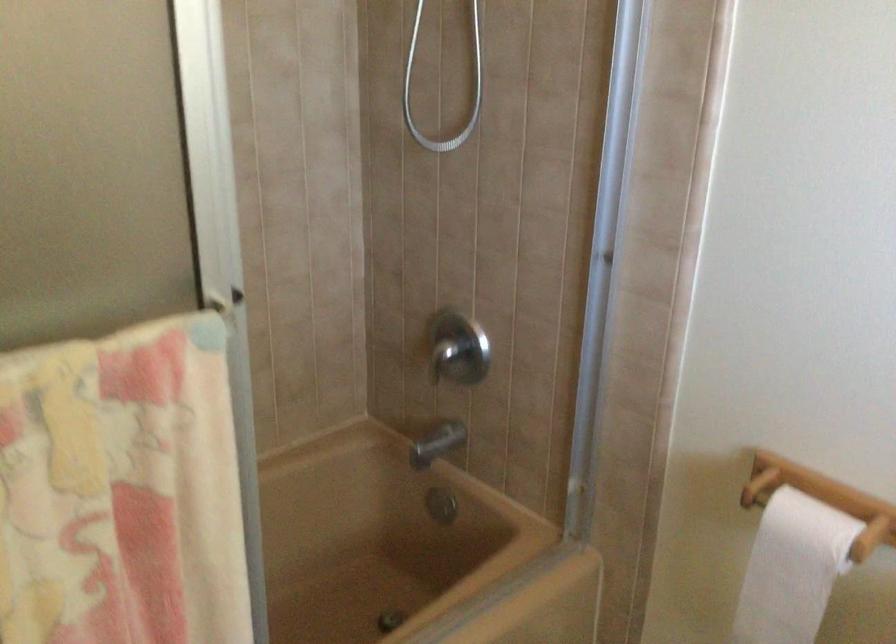
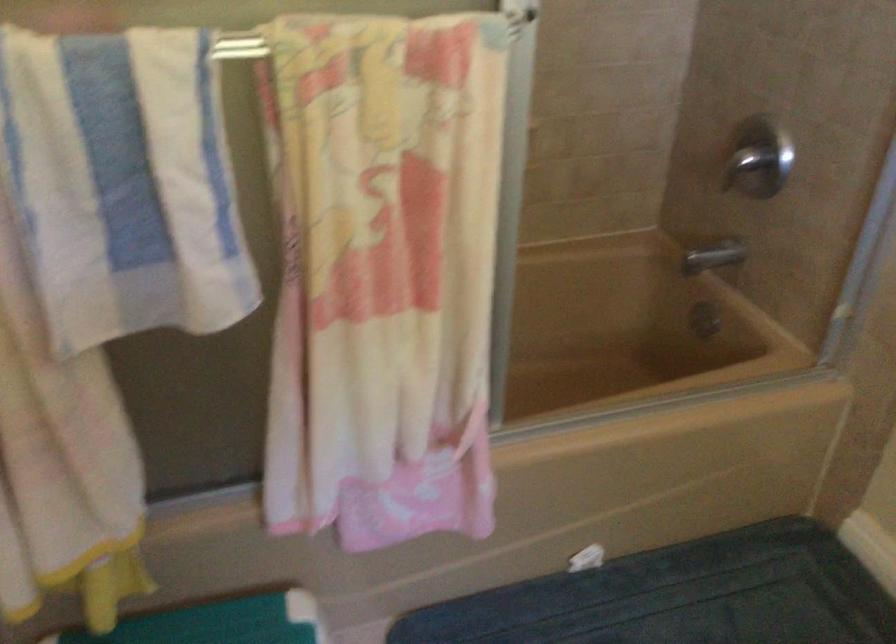
Question: How did the camera likely rotate?

Choices:
 (A) Left
 (B) Right
 (C) Up
 (D) Down

Answer: (A)